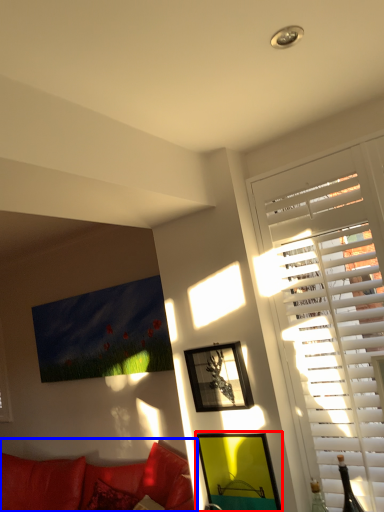
Question: Among these objects, which one is nearest to the camera, picture frame (highlighted by a red box) or studio couch (highlighted by a blue box)?

Choices:
 (A) picture frame
 (B) studio couch

Answer: (A)